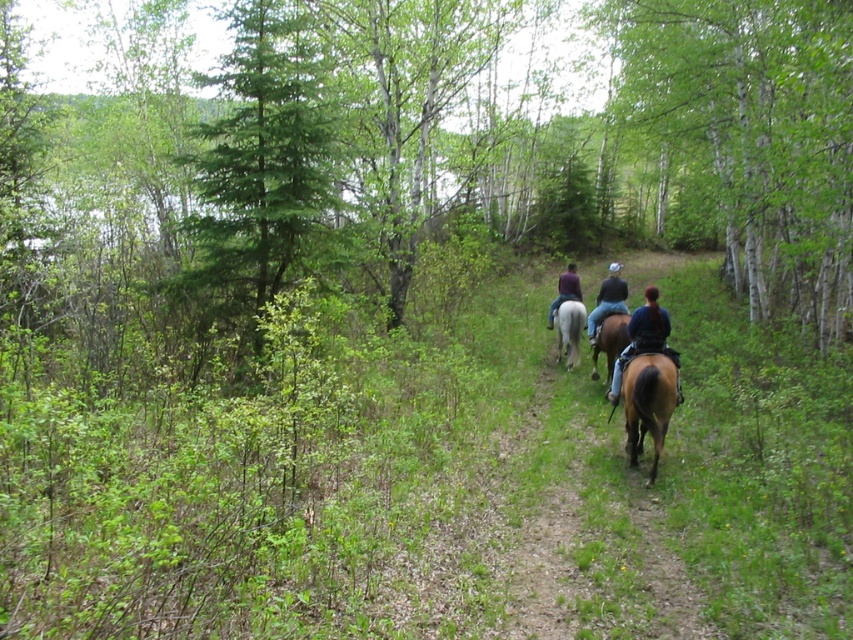
Question: Which of the following is the closest to the observer?

Choices:
 (A) (608, 268)
 (B) (618, 371)
 (C) (267, 90)
 (D) (610, 352)

Answer: (B)

Question: Can you confirm if green leafy tree at right is bigger than brown glossy horse at lower center?

Choices:
 (A) no
 (B) yes

Answer: (B)

Question: Which point is farther from the camera taking this photo?

Choices:
 (A) coord(662,209)
 (B) coord(601,326)
 (C) coord(643,356)
 (D) coord(610,360)

Answer: (A)

Question: Considering the real-world distances, which object is farthest from the brown glossy horse at center?

Choices:
 (A) purple fabric at center
 (B) green leafy tree at right

Answer: (B)

Question: Is brown leather horse at center above brown glossy horse at center?

Choices:
 (A) no
 (B) yes

Answer: (B)

Question: Is brown leather horse at center in front of purple fabric at center?

Choices:
 (A) no
 (B) yes

Answer: (B)